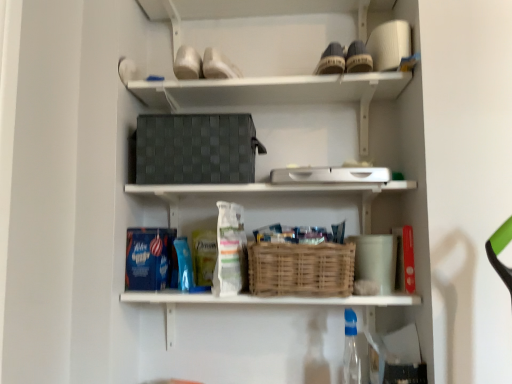
Question: From the image's perspective, is dark gray woven basket at upper center, which is the second shelf from bottom to top, under transparent plastic bottle at lower center?

Choices:
 (A) no
 (B) yes

Answer: (A)

Question: Does dark gray woven basket at upper center, the first shelf viewed from the top, have a greater width compared to transparent plastic bottle at lower center?

Choices:
 (A) yes
 (B) no

Answer: (A)

Question: From the image's perspective, is dark gray woven basket at upper center, which is the second shelf from bottom to top, above transparent plastic bottle at lower center?

Choices:
 (A) no
 (B) yes

Answer: (B)

Question: Is the position of dark gray woven basket at upper center, which is the second shelf from bottom to top, less distant than that of transparent plastic bottle at lower center?

Choices:
 (A) yes
 (B) no

Answer: (B)

Question: From a real-world perspective, is dark gray woven basket at upper center, which is the second shelf from bottom to top, located higher than transparent plastic bottle at lower center?

Choices:
 (A) yes
 (B) no

Answer: (A)

Question: Does point (215, 190) appear closer or farther from the camera than point (350, 365)?

Choices:
 (A) closer
 (B) farther

Answer: (B)

Question: Considering the positions of woven wicker basket at center, the 1th shelf from the bottom, and transparent plastic bottle at lower center in the image, is woven wicker basket at center, the 1th shelf from the bottom, wider or thinner than transparent plastic bottle at lower center?

Choices:
 (A) thin
 (B) wide

Answer: (B)

Question: From their relative heights in the image, would you say woven wicker basket at center, the 1th shelf from the bottom, is taller or shorter than transparent plastic bottle at lower center?

Choices:
 (A) short
 (B) tall

Answer: (A)

Question: Based on their positions, is woven wicker basket at center, which is the second shelf in top-to-bottom order, located to the left or right of transparent plastic bottle at lower center?

Choices:
 (A) right
 (B) left

Answer: (B)

Question: Do you think transparent plastic bottle at lower center is within woven wicker basket at center, the 1th shelf from the bottom, or outside of it?

Choices:
 (A) outside
 (B) inside

Answer: (A)

Question: From the image's perspective, is transparent plastic bottle at lower center located above or below woven wicker basket at center, the 1th shelf from the bottom?

Choices:
 (A) below
 (B) above

Answer: (A)

Question: Considering their positions, is transparent plastic bottle at lower center located in front of or behind woven wicker basket at center, which is the second shelf in top-to-bottom order?

Choices:
 (A) front
 (B) behind

Answer: (A)

Question: Looking at the image, does transparent plastic bottle at lower center seem bigger or smaller compared to woven wicker basket at center, the 1th shelf from the bottom?

Choices:
 (A) big
 (B) small

Answer: (B)

Question: Is bamboo basket at center inside the boundaries of transparent plastic bottle at lower center, or outside?

Choices:
 (A) outside
 (B) inside

Answer: (A)

Question: Visually, is bamboo basket at center positioned to the left or to the right of transparent plastic bottle at lower center?

Choices:
 (A) right
 (B) left

Answer: (B)